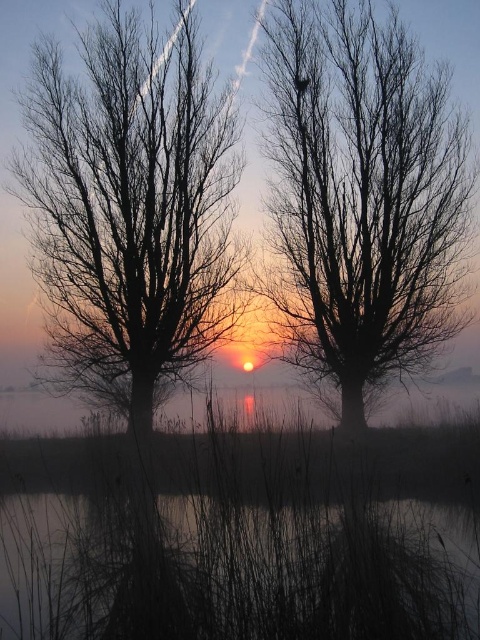
You are an artist sketching the sunrise scene. You want to draw the black matte tree at center and the dark matte water at lower center accurately. Which object is located to the right of the other?

The black matte tree at center is positioned on the right side of dark matte water at lower center.

You are an astronomer observing the sunrise and notice a point at coordinates (132, 204) in the scene. Based on the description, which object does this point belong to?

The point at coordinates (132, 204) belongs to the black matte tree at left as stated in the objects description.

You are standing at the camera position observing the sunrise scene. There is a specific point marked at coordinates point (x=399, y=230). Do you think you can reach that point by taking 16 steps forward?

The point (x=399, y=230) is 15.32 meters away from camera. Since 16 steps would cover approximately 12.8 meters assuming an average step length of 0.8 meters per step, you would not reach the point as 12.8 meters is less than 15.32 meters.